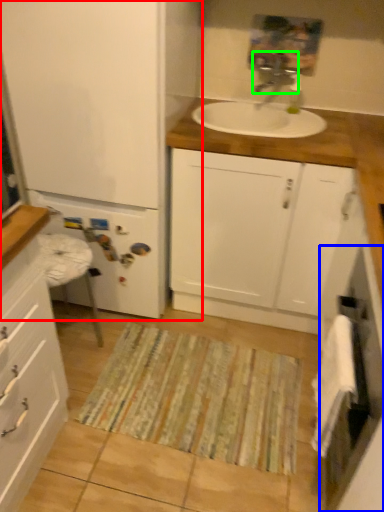
Question: Estimate the real-world distances between objects in this image. Which object is closer to bathroom cabinet (highlighted by a red box), screen door (highlighted by a blue box) or tap (highlighted by a green box)?

Choices:
 (A) screen door
 (B) tap

Answer: (B)